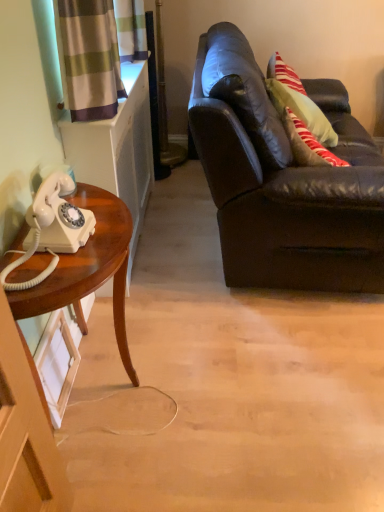
Question: Considering the relative positions of white glossy corded phone at left and wooden desk at left in the image provided, is white glossy corded phone at left to the left or to the right of wooden desk at left?

Choices:
 (A) right
 (B) left

Answer: (B)

Question: In terms of width, does white glossy corded phone at left look wider or thinner when compared to wooden desk at left?

Choices:
 (A) wide
 (B) thin

Answer: (B)

Question: Which object is positioned closest to the matte black leather couch at right?

Choices:
 (A) white glossy corded phone at left
 (B) wooden desk at left

Answer: (B)

Question: Which object is the farthest from the wooden desk at left?

Choices:
 (A) matte black leather couch at right
 (B) white glossy corded phone at left

Answer: (A)